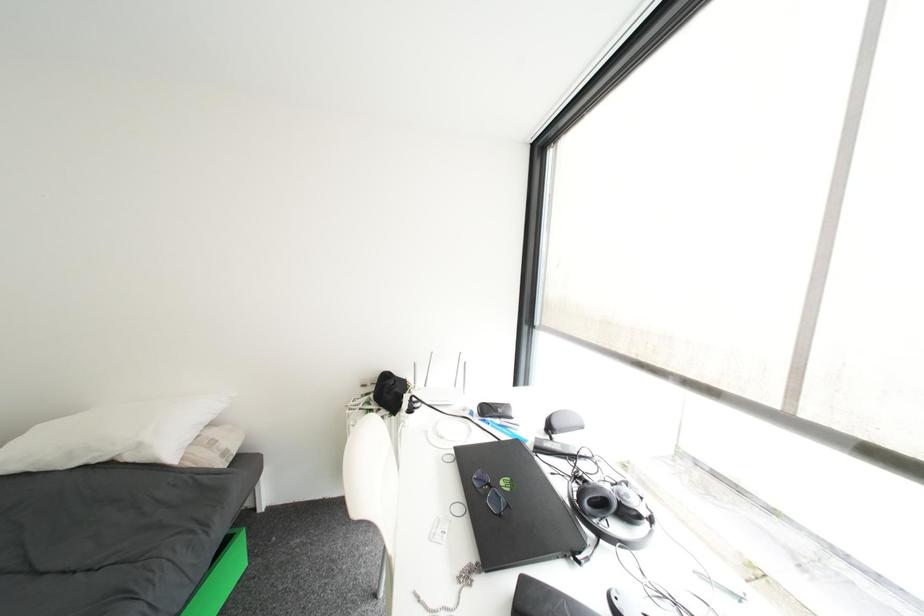
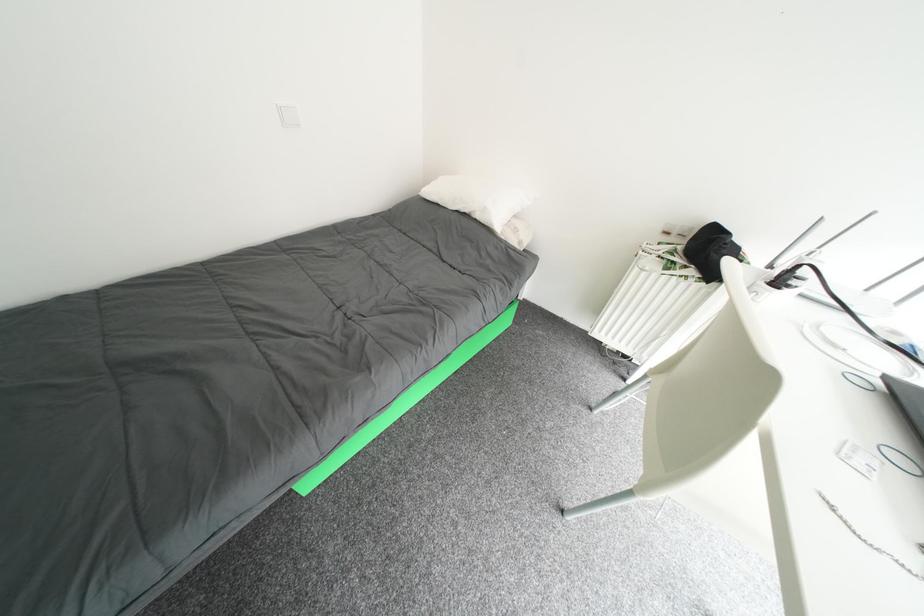
How did the camera likely rotate?

The camera's rotation is toward left-down.